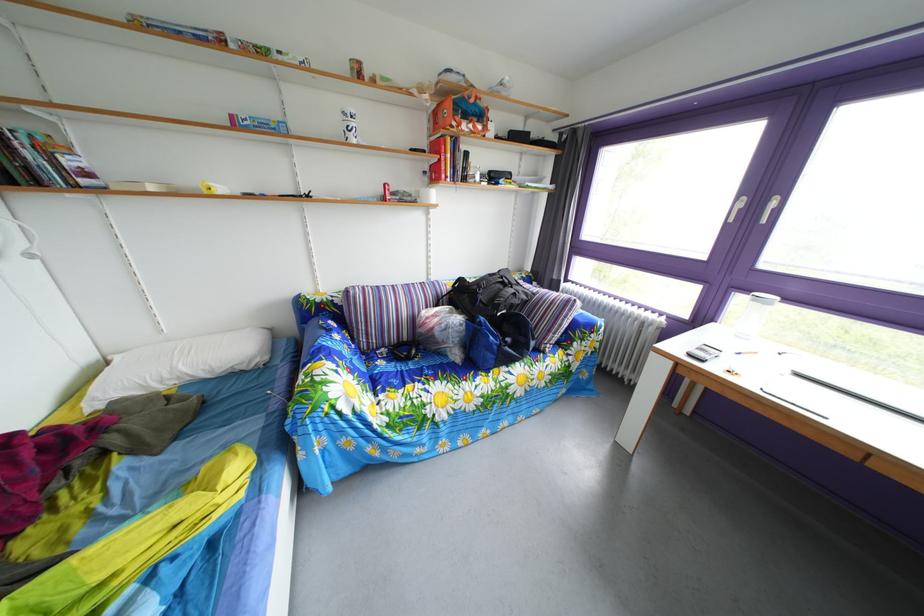
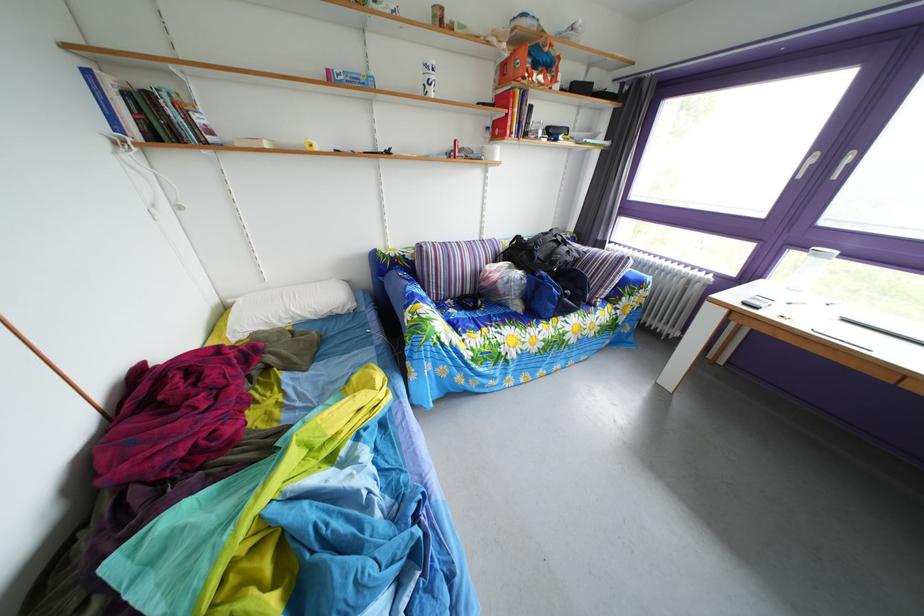
Locate, in the second image, the point that corresponds to (x=334, y=339) in the first image.

(417, 290)